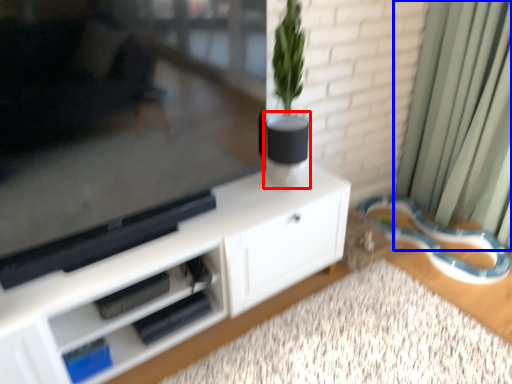
Question: Which object appears farthest to the camera in this image, vase (highlighted by a red box) or curtain (highlighted by a blue box)?

Choices:
 (A) vase
 (B) curtain

Answer: (A)